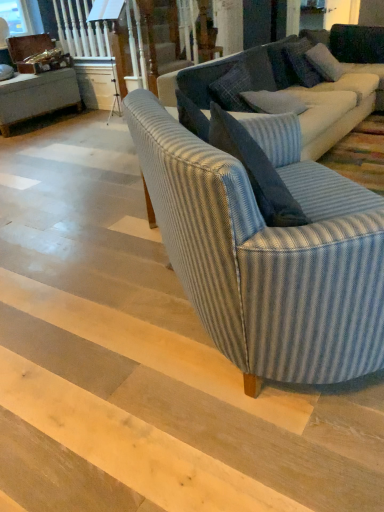
Question: Looking at their shapes, would you say blue textured pillow at upper right, the 3th pillow viewed from the front, is wider or thinner than blue striped fabric couch at center, arranged as the 2th studio couch when viewed from the front?

Choices:
 (A) wide
 (B) thin

Answer: (B)

Question: Looking at the image, does blue textured pillow at upper right, placed as the first pillow when sorted from back to front, seem bigger or smaller compared to blue striped fabric couch at center, arranged as the 2th studio couch when viewed from the front?

Choices:
 (A) small
 (B) big

Answer: (A)

Question: Estimate the real-world distances between objects in this image. Which object is farther from the blue striped fabric couch at center, placed as the 1th studio couch when sorted from front to back?

Choices:
 (A) blue textured pillow at upper right, placed as the first pillow when sorted from back to front
 (B) blue textured pillow at center, placed as the 3th pillow when sorted from back to front
 (C) blue striped fabric armchair at center
 (D) blue textured pillow at upper right, positioned as the 2th pillow in back-to-front order
 (E) blue striped fabric couch at center, which is the 1th studio couch in back-to-front order

Answer: (D)

Question: Which is farther from the blue textured pillow at upper right, the second pillow in the front-to-back sequence?

Choices:
 (A) blue striped fabric couch at center, which is the 2th studio couch in back-to-front order
 (B) blue textured pillow at center, which is counted as the 1th pillow, starting from the front
 (C) blue striped fabric couch at center, arranged as the 2th studio couch when viewed from the front
 (D) blue textured pillow at upper right, placed as the first pillow when sorted from back to front
 (E) blue striped fabric armchair at center

Answer: (E)